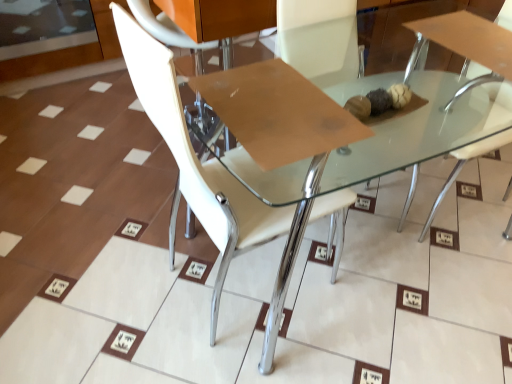
Find the location of a particular element. free space between white glossy chair at center, the 1th chair in the left-to-right sequence, and clear glass table at center is located at coordinates (211, 309).